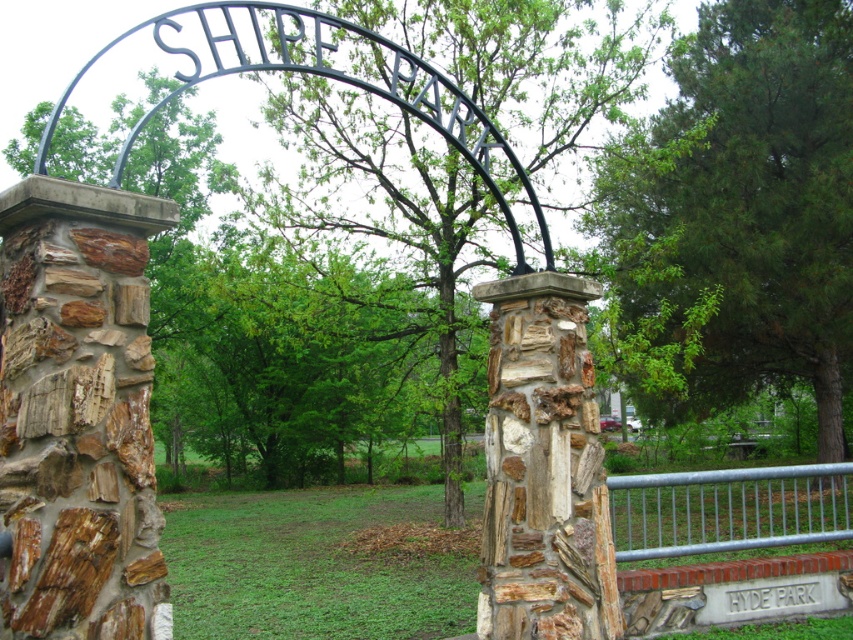
Between green leafy tree at center and galvanized metal fence at lower right, which one has more height?

With more height is green leafy tree at center.

Between point (753, 48) and point (815, 468), which one is positioned in front?

Point (815, 468) is more forward.

The width and height of the screenshot is (853, 640). Identify the location of green leafy tree at center. (741, 208).

Does rustic stone pillar at center have a greater height compared to galvanized metal fence at lower right?

Yes.

Can you confirm if rustic stone pillar at center is wider than galvanized metal fence at lower right?

No.

Find the location of a particular element. The width and height of the screenshot is (853, 640). rustic stone pillar at center is located at coordinates (543, 468).

Where is `rustic stone pillar at center`? This screenshot has width=853, height=640. rustic stone pillar at center is located at coordinates (543, 468).

Which is behind, point (24, 385) or point (711, 493)?

The point (711, 493) is behind.

Which is more to the left, brown stone pillar at left or galvanized metal fence at lower right?

brown stone pillar at left is more to the left.

Is point (36, 490) positioned after point (660, 544)?

No, (36, 490) is closer to viewer.

Locate an element on the screen. brown stone pillar at left is located at coordinates (78, 413).